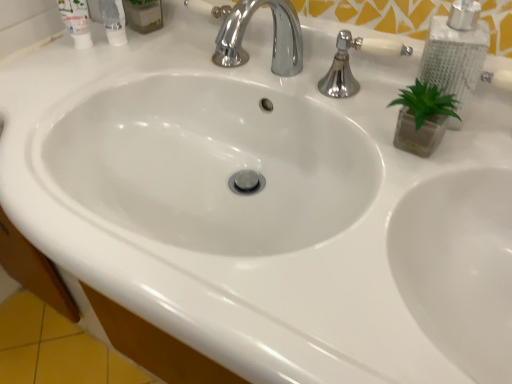
Question: Do you think silver metallic soap dispenser at upper right is within white glossy tube at upper left, which appears as the 2th mouthwash when viewed from the right, or outside of it?

Choices:
 (A) outside
 (B) inside

Answer: (A)

Question: In the image, is silver metallic soap dispenser at upper right positioned in front of or behind white glossy tube at upper left, the 1th mouthwash from the left?

Choices:
 (A) front
 (B) behind

Answer: (A)

Question: Considering the real-world distances, which object is farthest from the chrome metallic faucet at upper center?

Choices:
 (A) white plastic mouthwash at upper left, the second mouthwash positioned from the left
 (B) silver metallic soap dispenser at upper right
 (C) white glossy tube at upper left, the 1th mouthwash from the left
 (D) polished chrome faucet at upper center

Answer: (C)

Question: Which object is the farthest from the polished chrome faucet at upper center?

Choices:
 (A) white plastic mouthwash at upper left, the second mouthwash positioned from the left
 (B) silver metallic soap dispenser at upper right
 (C) chrome metallic faucet at upper center
 (D) white glossy tube at upper left, the 1th mouthwash from the left

Answer: (D)